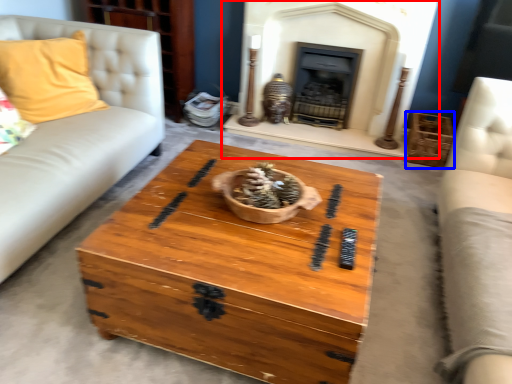
Question: Which of the following is the farthest to the observer, fireplace (highlighted by a red box) or crate (highlighted by a blue box)?

Choices:
 (A) fireplace
 (B) crate

Answer: (B)